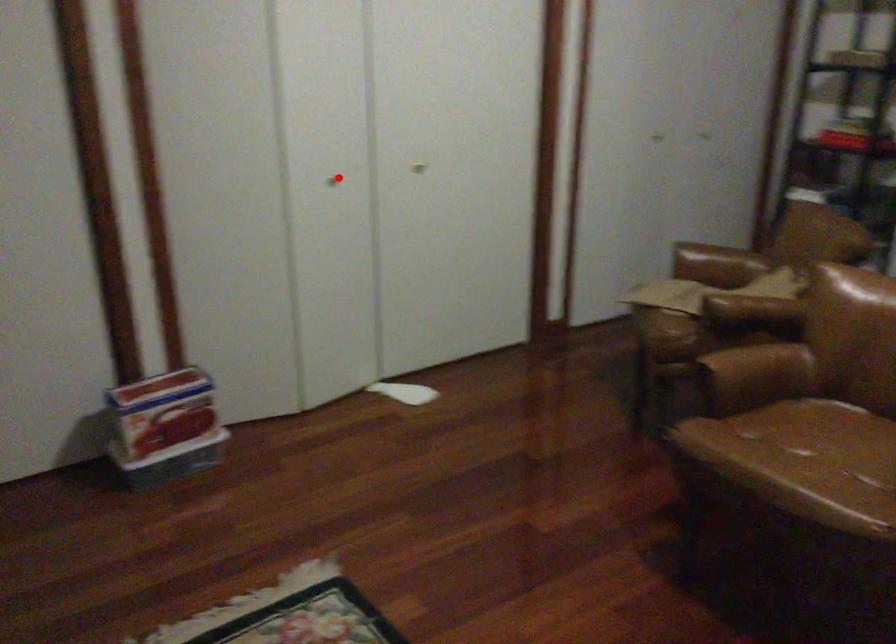
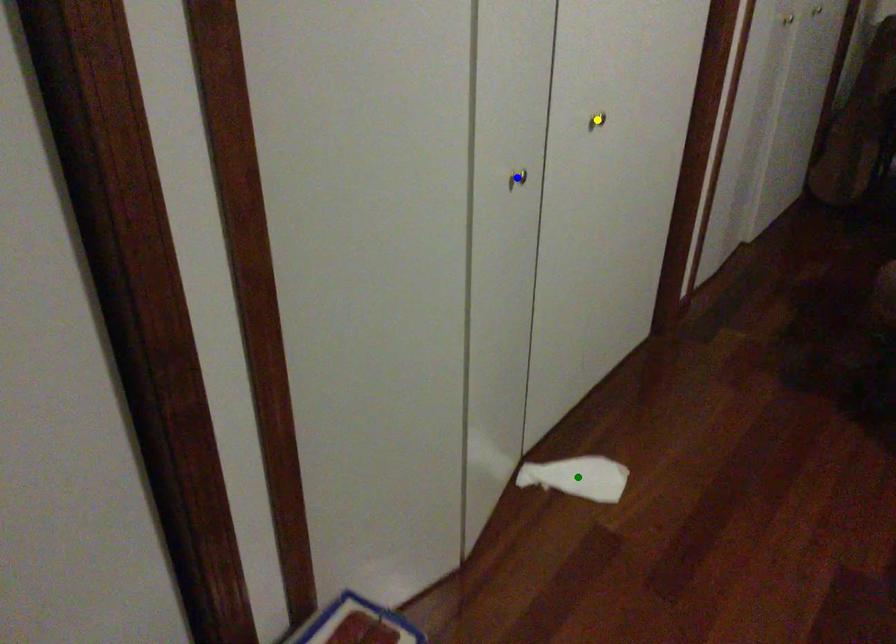
Question: I am providing you with two images of the same scene from different viewpoints. A red point is marked on the first image. You are given multiple points on the second image. In image 2, which mark is for the same physical point as the one in image 1?

Choices:
 (A) blue point
 (B) green point
 (C) yellow point

Answer: (A)